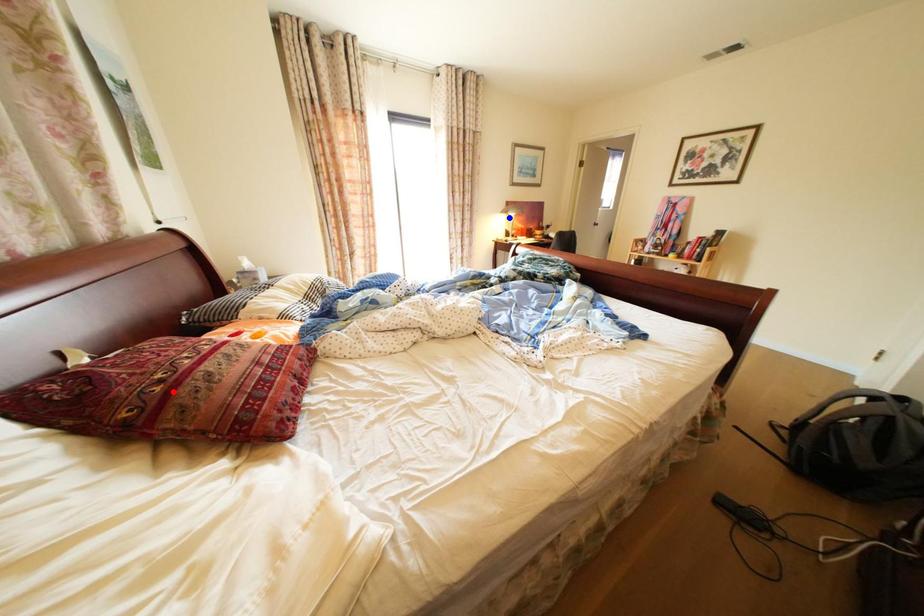
Question: Which of the two points in the image is closer to the camera?

Choices:
 (A) Blue point is closer.
 (B) Red point is closer.

Answer: (B)